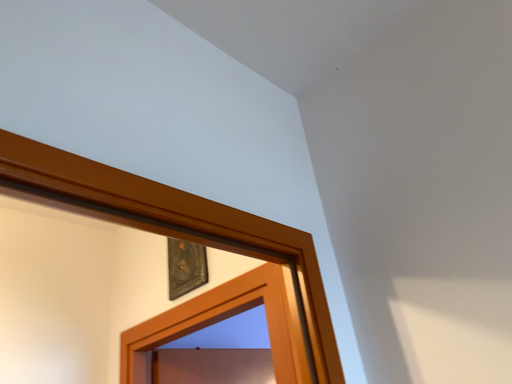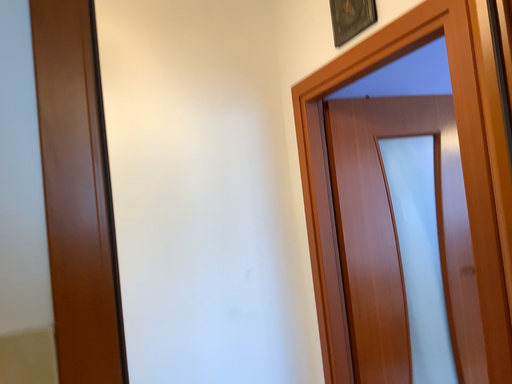
Question: How did the camera likely rotate when shooting the video?

Choices:
 (A) rotated right
 (B) rotated left

Answer: (B)